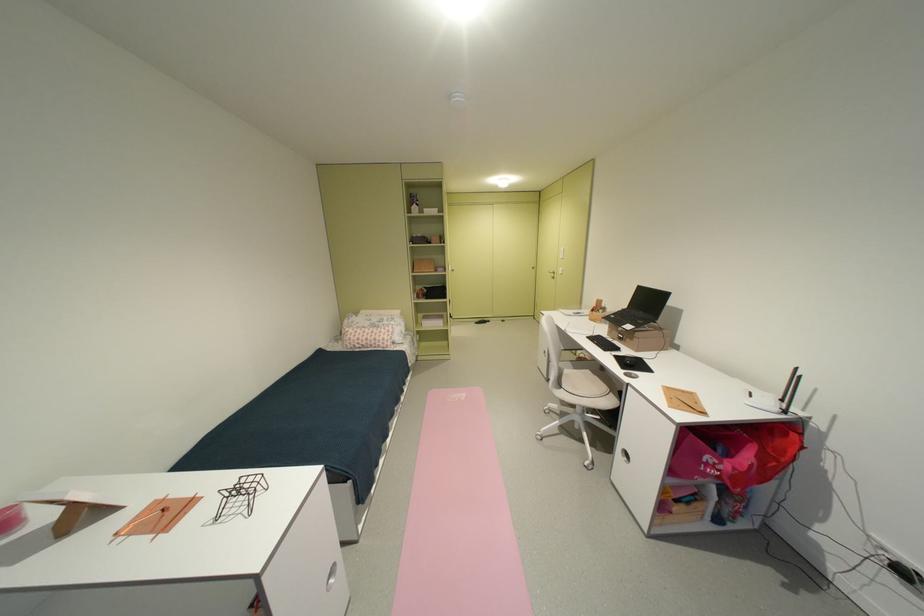
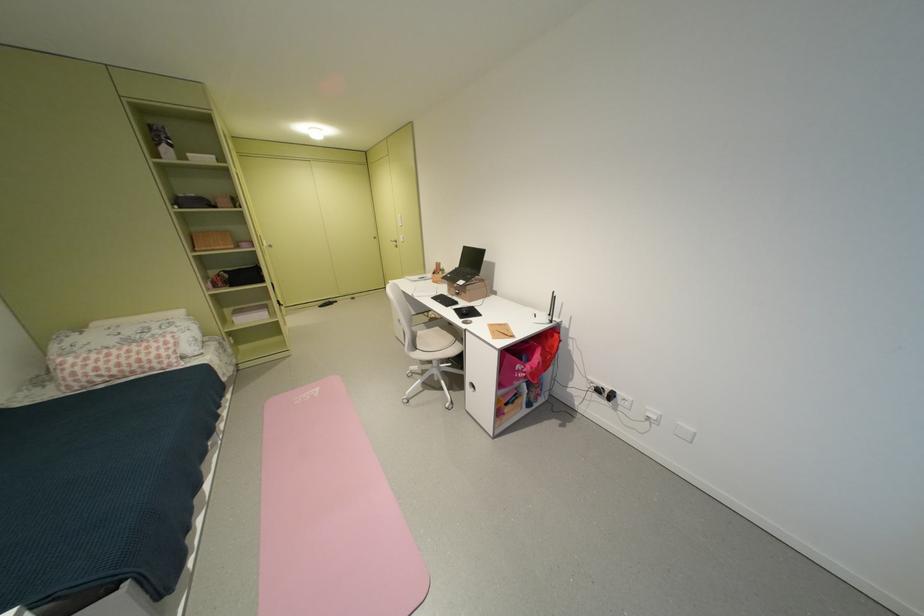
Where in the second image is the point corresponding to the point at 720,472 from the first image?

(530, 376)